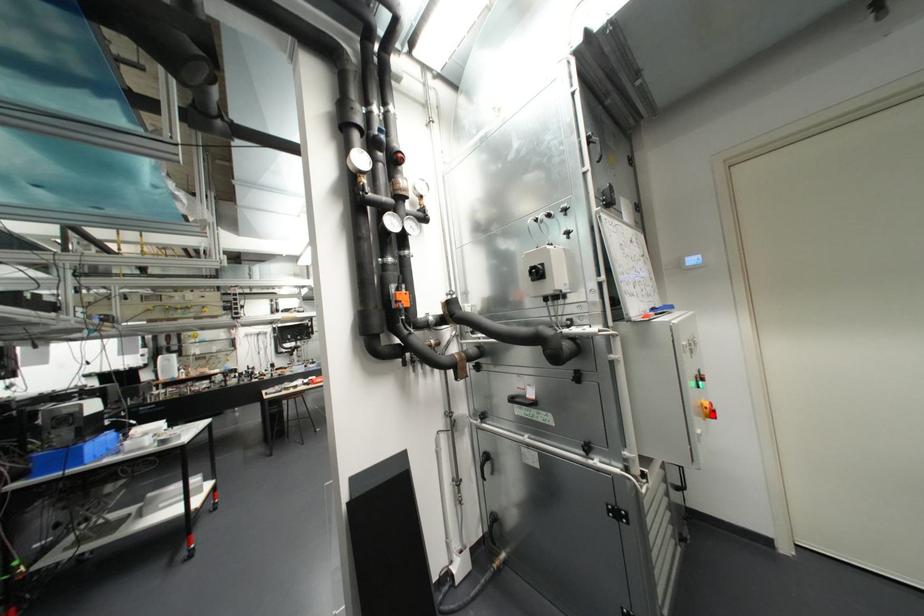
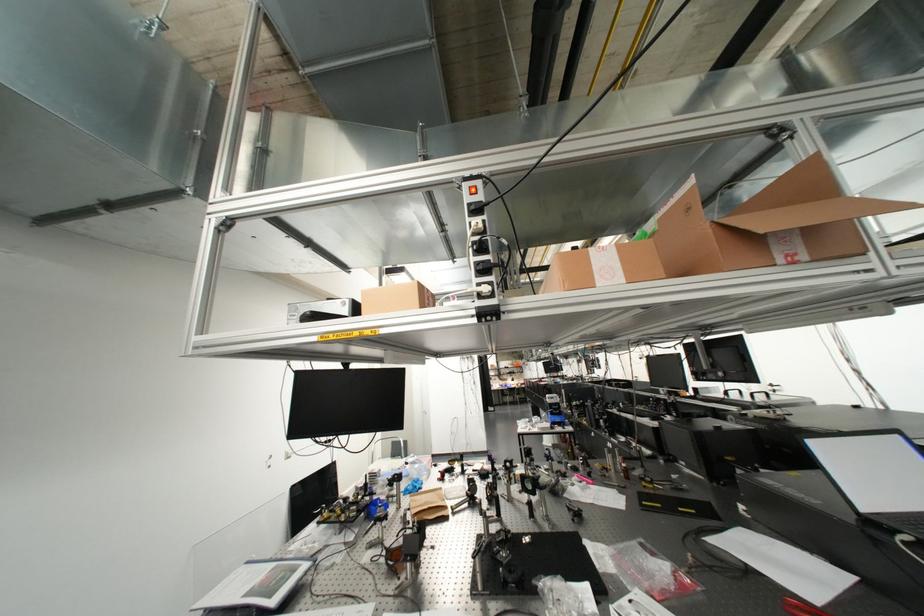
Question: I am providing you with two images of the same scene from different viewpoints. A red point is marked on the first image. Can you still see the location of the red point in image 2?

Choices:
 (A) Yes
 (B) No

Answer: (B)